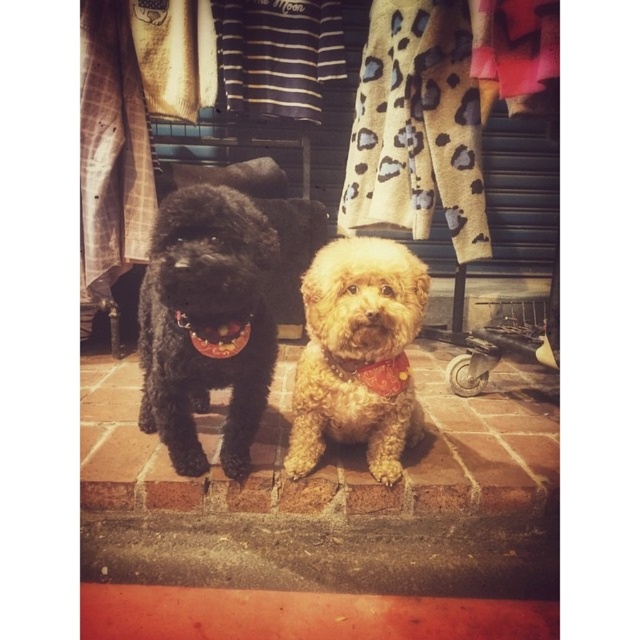
You are a photographer setting up a tripod to capture the shiny black dog at center and the orange fabric neckband at center. To ensure both are in focus, you need to know which object is taller. Which one is taller?

The shiny black dog at center is taller than the orange fabric neckband at center according to the description.

You are taking a photo of two dogs sitting on a brick surface outside a shop. You notice two points in the image at coordinates point (253, 321) and point (328, 358). Which point is closer to the camera?

Point (253, 321) is closer to the camera than point (328, 358).